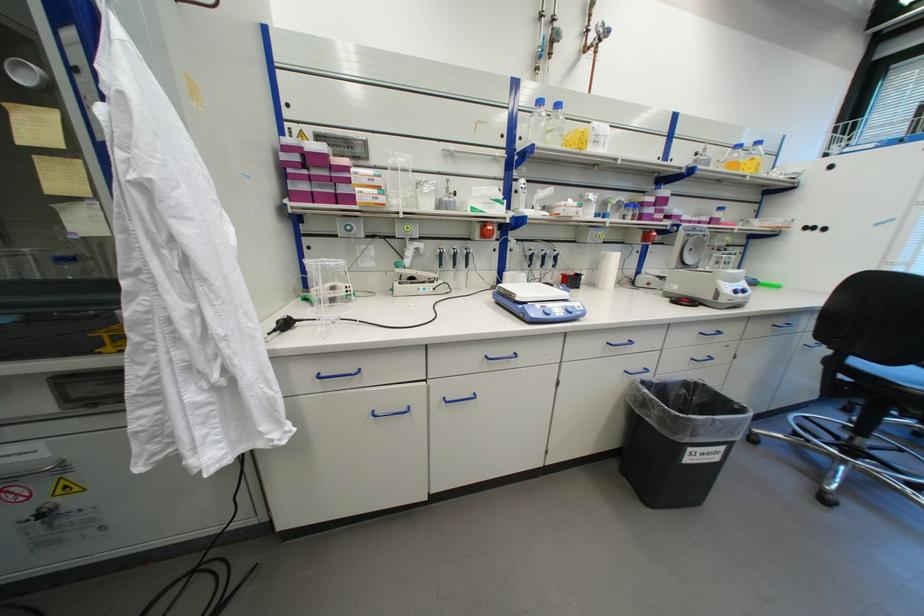
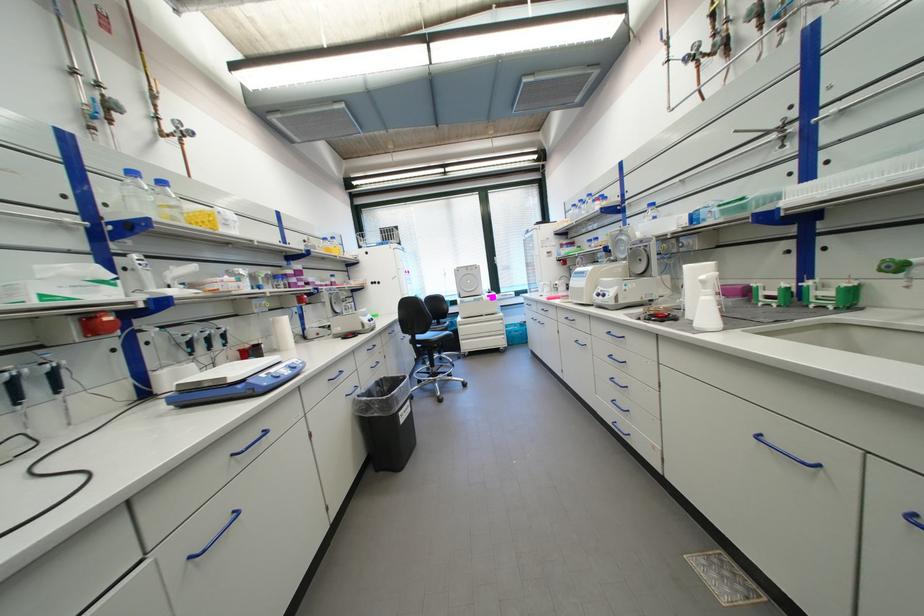
Find the pixel in the second image that matches [603,267] in the first image.

(276, 334)